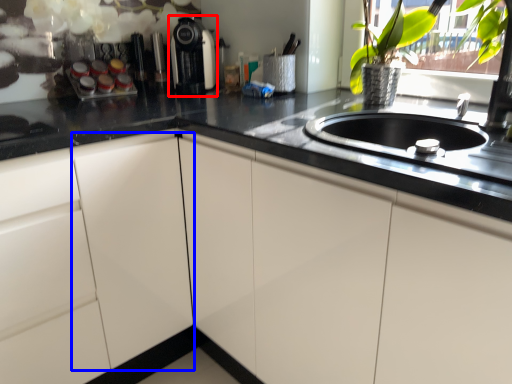
Question: Which object appears farthest to the camera in this image, coffee machine (highlighted by a red box) or cabinetry (highlighted by a blue box)?

Choices:
 (A) coffee machine
 (B) cabinetry

Answer: (A)